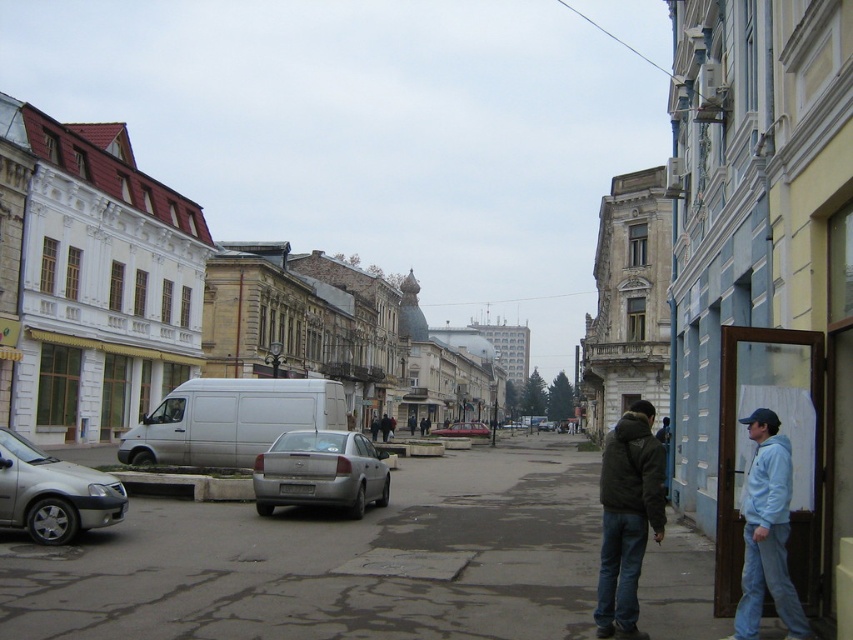
You are a delivery person standing at the edge of the street. You need to deliver a package to the person wearing the dark blue jacket at center. The matte silver sedan at center is blocking your path. Can you walk around the sedan to reach the person?

The matte silver sedan at center is further to the viewer than dark blue jacket at center, so you can walk around the sedan to reach the person wearing the dark blue jacket at center.

What is the color of the clothing item located at the coordinates point [767,532] in the lower right of the image?

The point [767,532] in the lower right of the image indicates a light blue hoodie.

You are a delivery person trying to determine the best path to deliver a package. You see a light blue hoodie at lower right and a silver metallic sedan at lower left. Which object is bigger and could potentially block your path?

The light blue hoodie at lower right has a larger size compared to the silver metallic sedan at lower left, so it could potentially block your path more than the silver metallic sedan at lower left.